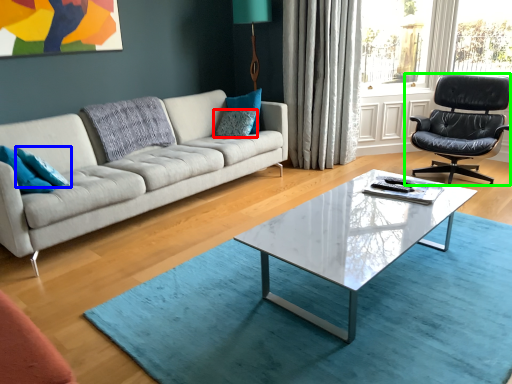
Question: Based on their relative distances, which object is nearer to pillow (highlighted by a red box)? Choose from pillow (highlighted by a blue box) and chair (highlighted by a green box).

Choices:
 (A) pillow
 (B) chair

Answer: (A)